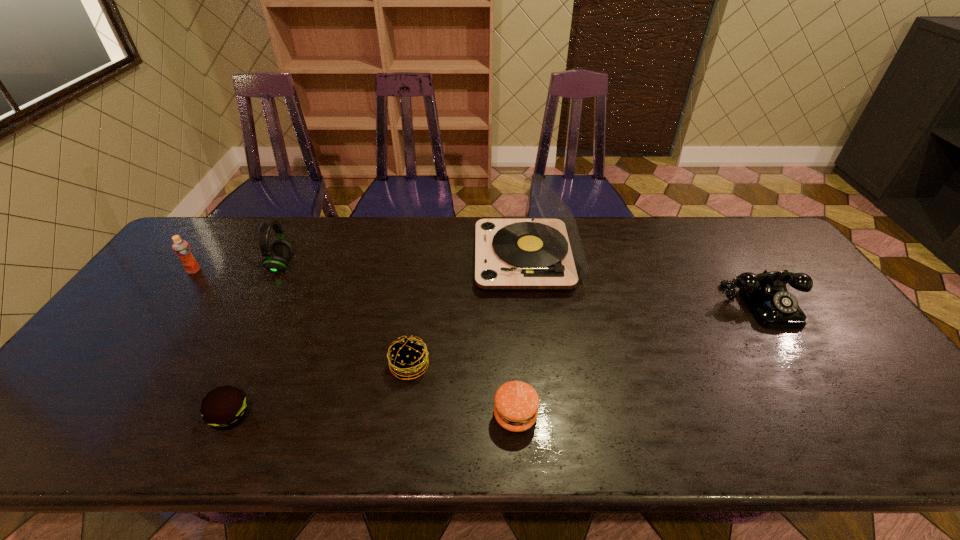
Find the location of a particular element. This screenshot has height=540, width=960. vacant area situated with the tonearm facing the front of the record player is located at coordinates (413, 258).

Identify the location of free location located with the tonearm facing the front of the record player. (353, 258).

Locate an element on the screen. This screenshot has width=960, height=540. free region located with the tonearm facing the front of the record player is located at coordinates (391, 258).

The height and width of the screenshot is (540, 960). Identify the location of free region located 0.360m on the ear cups of the headset. (408, 266).

The height and width of the screenshot is (540, 960). I want to click on free region located on the right of the leftmost object, so click(x=246, y=271).

Find the location of `vacant space located 0.110m on the dial of the telephone`. vacant space located 0.110m on the dial of the telephone is located at coordinates (804, 362).

Identify the location of blank space located on the left of the fourth object from left to right. (277, 366).

Identify the location of vacant area located on the back of the rightmost patty. The width and height of the screenshot is (960, 540). (508, 305).

The height and width of the screenshot is (540, 960). Identify the location of blank space located 0.360m on the back of the leftmost patty. (288, 292).

Locate an element on the screen. record player at the far edge is located at coordinates (545, 253).